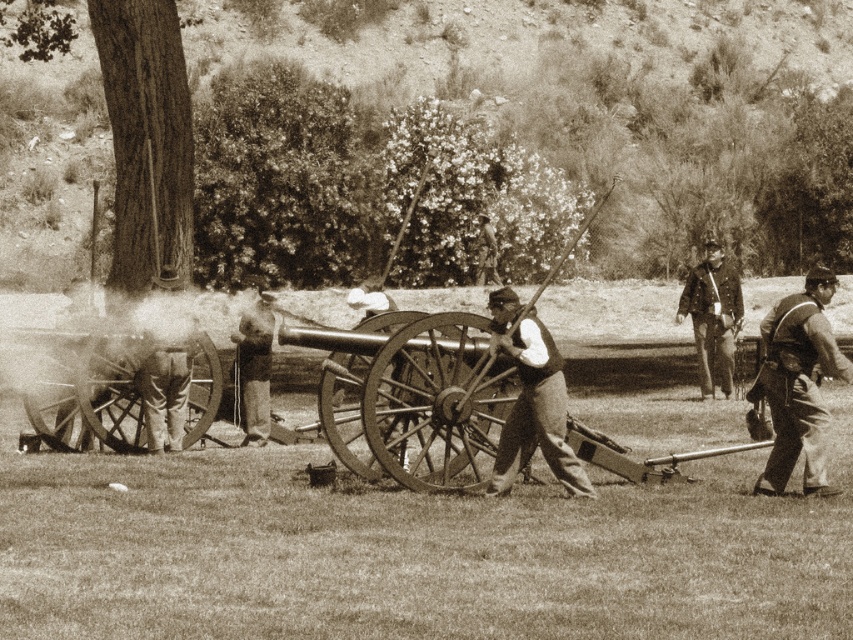
Question: Is polished brass cannon at center bigger than rustic leather vest at right?

Choices:
 (A) no
 (B) yes

Answer: (A)

Question: Among these points, which one is farthest from the camera?

Choices:
 (A) (254, 420)
 (B) (717, 356)

Answer: (B)

Question: Which point appears closest to the camera in this image?

Choices:
 (A) (727, 385)
 (B) (537, 321)
 (C) (270, 358)
 (D) (367, 435)

Answer: (B)

Question: Does polished brass cannon at center appear on the right side of matte black vest at center?

Choices:
 (A) no
 (B) yes

Answer: (A)

Question: Which point is farther to the camera?

Choices:
 (A) (712, 241)
 (B) (258, 368)

Answer: (A)

Question: Does matte black vest at center have a larger size compared to smooth leather hat at upper right?

Choices:
 (A) yes
 (B) no

Answer: (B)